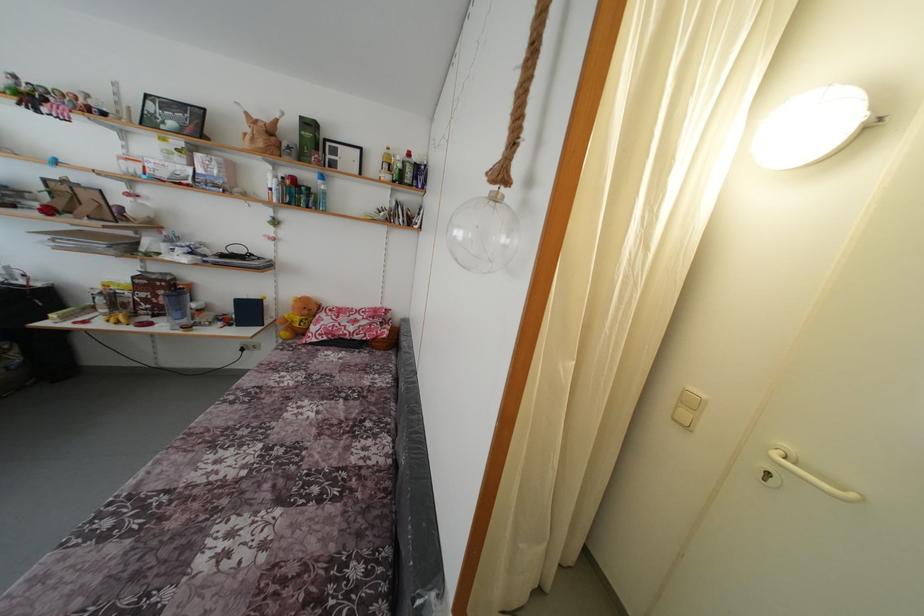
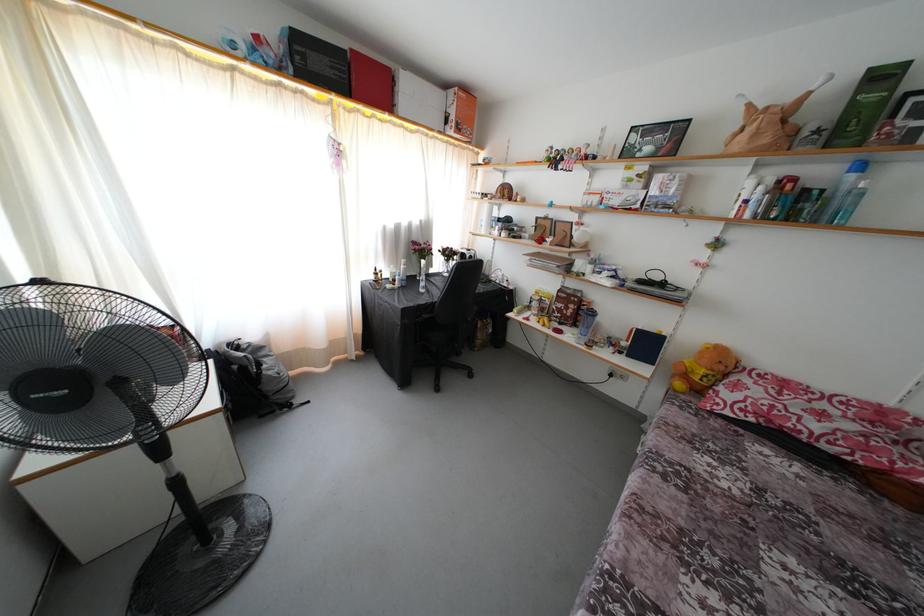
Locate, in the second image, the point that corresponds to [310,317] in the first image.

(726, 373)